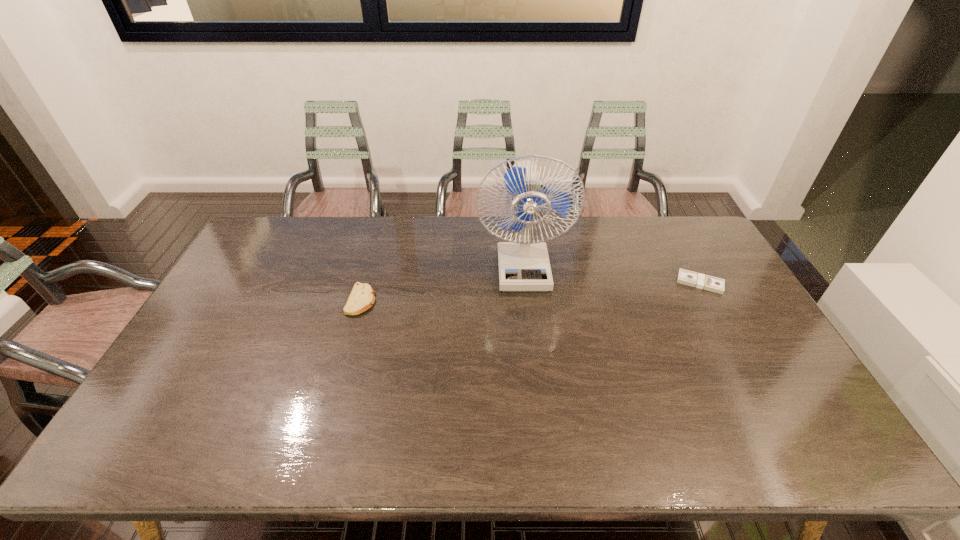
Find the location of a particular element. The width and height of the screenshot is (960, 540). object that is at the right edge is located at coordinates (686, 277).

Image resolution: width=960 pixels, height=540 pixels. In the image, there is a desktop. In order to click on free space at the far edge in this screenshot , I will do `click(393, 255)`.

This screenshot has height=540, width=960. In the image, there is a desktop. Identify the location of vacant space at the near edge. coord(676,429).

The height and width of the screenshot is (540, 960). I want to click on free space at the left edge, so click(217, 311).

In order to click on vacant space at the right edge of the desktop in this screenshot , I will do `click(727, 356)`.

Find the location of a particular element. This screenshot has height=540, width=960. free region at the near right corner of the desktop is located at coordinates (830, 439).

Find the location of `free spot between the pita bread and the second object from left to right`. free spot between the pita bread and the second object from left to right is located at coordinates (442, 284).

The height and width of the screenshot is (540, 960). Find the location of `empty space that is in between the tallest object and the shortest object`. empty space that is in between the tallest object and the shortest object is located at coordinates (612, 275).

This screenshot has height=540, width=960. I want to click on vacant point located between the second object from left to right and the second tallest object, so click(442, 284).

Identify the location of free space that is in between the second object from left to right and the pita bread. (442, 284).